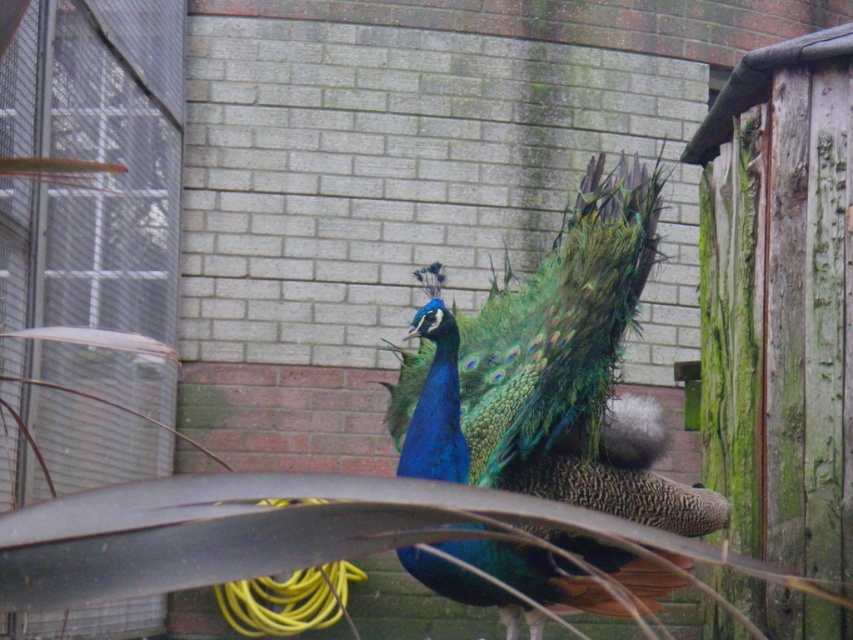
You are a photographer trying to capture the shiny blue peacock at center and the yellow rubber hose at lower center in a single shot. Since the peacock is taller, will you need to adjust your camera angle upwards or downwards to include both subjects?

The shiny blue peacock at center is taller than the yellow rubber hose at lower center, so you will need to adjust your camera angle upwards to capture both subjects in the frame.

You are a photographer trying to capture the shiny blue peacock at center and the yellow rubber hose at lower center in the same frame. Based on their positions, which object should you focus on first to ensure both are in focus?

The shiny blue peacock at center is above the yellow rubber hose at lower center, so focusing on the peacock first will help ensure both are in focus since it is positioned higher in the frame.

You are a gardener who needs to water the plants near the shiny blue peacock at center and the yellow rubber hose at lower center. Which object should you approach first if you want to reach the peacock before the hose?

The shiny blue peacock at center is to the right of the yellow rubber hose at lower center, so you should approach the hose first to reach the peacock before the hose.